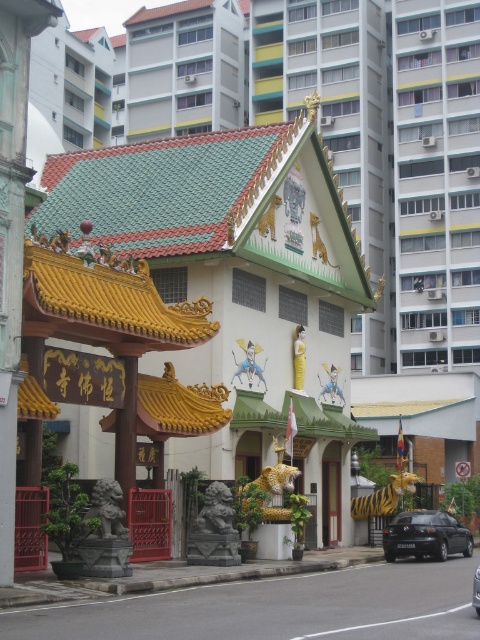
Question: Does black matte car at lower right have a smaller size compared to black glossy car at center?

Choices:
 (A) yes
 (B) no

Answer: (A)

Question: Which of the following is the farthest from the observer?

Choices:
 (A) (446, 556)
 (B) (479, 605)

Answer: (A)

Question: From the image, what is the correct spatial relationship of black matte car at lower right in relation to black glossy car at center?

Choices:
 (A) below
 (B) above

Answer: (A)

Question: Does black matte car at lower right appear on the left side of black glossy car at center?

Choices:
 (A) no
 (B) yes

Answer: (A)